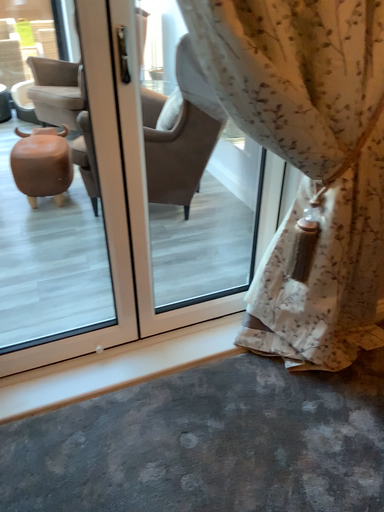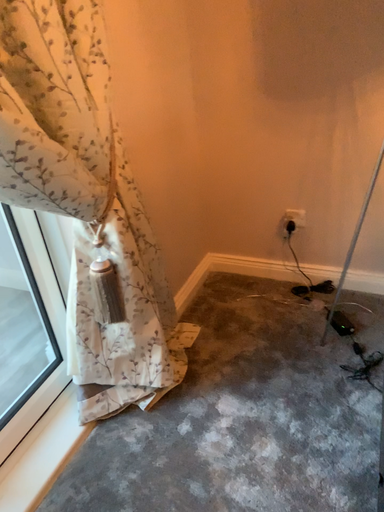
Question: How did the camera likely rotate when shooting the video?

Choices:
 (A) rotated right
 (B) rotated left

Answer: (A)